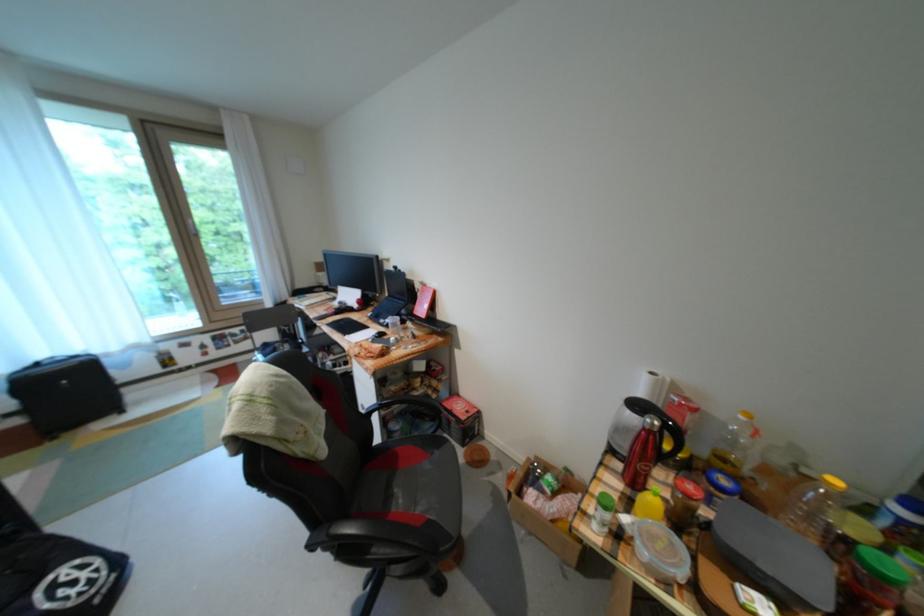
Where is `plastic food container`? Image resolution: width=924 pixels, height=616 pixels. plastic food container is located at coordinates (661, 552).